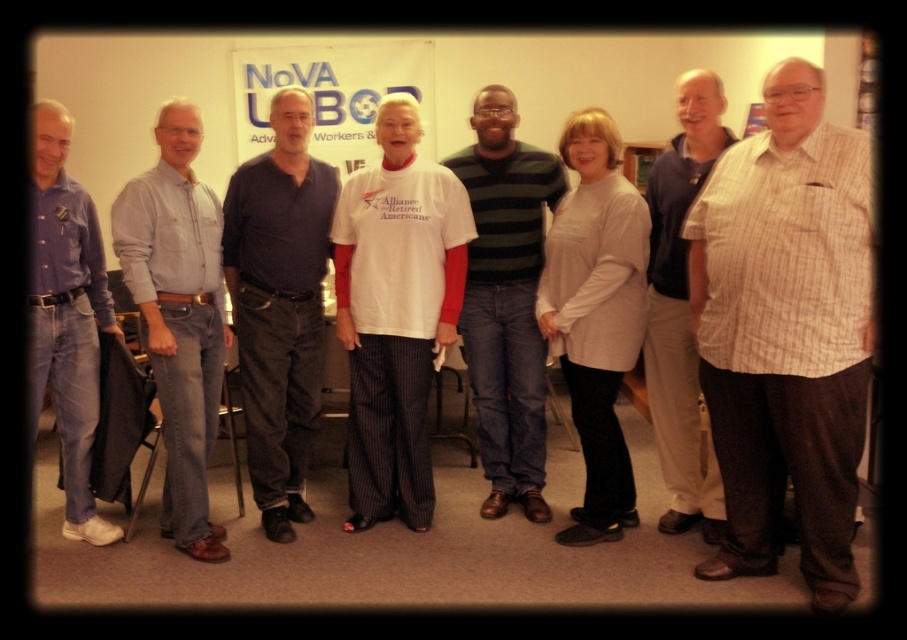
Can you confirm if white striped shirt at right is thinner than white shirt at center?

No, white striped shirt at right is not thinner than white shirt at center.

Between point (734, 152) and point (686, 116), which one is positioned behind?

The point (686, 116) is behind.

Who is more forward, [798,186] or [688,330]?

Point [798,186] is more forward.

At what (x,y) coordinates should I click in order to perform the action: click on white striped shirt at right. Please return your answer as a coordinate pair (x, y). The image size is (907, 640). Looking at the image, I should click on (786, 332).

Who is shorter, white striped shirt at right or green striped sweater at center?

With less height is white striped shirt at right.

I want to click on white striped shirt at right, so click(786, 332).

You are a GUI agent. You are given a task and a screenshot of the screen. Output one action in this format:
    pyautogui.click(x=<x>, y=<y>)
    Task: Click on the white striped shirt at right
    This screenshot has height=640, width=907.
    Given the screenshot: What is the action you would take?
    pyautogui.click(x=786, y=332)

Who is shorter, green striped sweater at center or matte blue shirt at left?

With less height is matte blue shirt at left.

Describe the element at coordinates (506, 300) in the screenshot. The height and width of the screenshot is (640, 907). I see `green striped sweater at center` at that location.

Identify the location of green striped sweater at center. (506, 300).